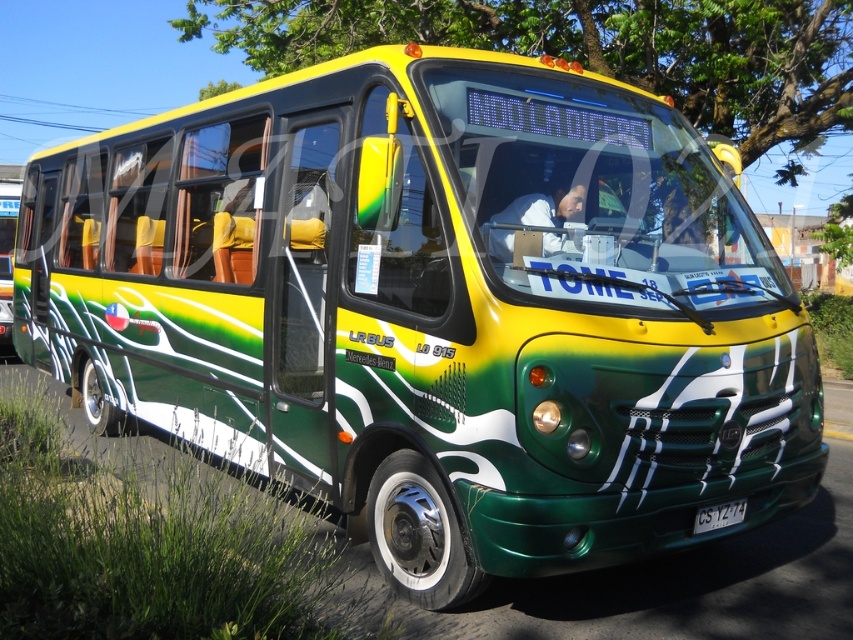
You are a bus driver who just parked the Mercedes Benz bus. You want to check the white fabric at center and the white plastic license plate at center. Which one is on the left side?

The white fabric at center is to the left of the white plastic license plate at center, so the white fabric at center is on the left side.

You are a bus driver who needs to check the license plate number for a report. You look through the windshield and see the white fabric at center and the white plastic license plate at center. Which object is blocking your view of the license plate?

The white fabric at center is blocking the view of the white plastic license plate at center because it is positioned in front of it.